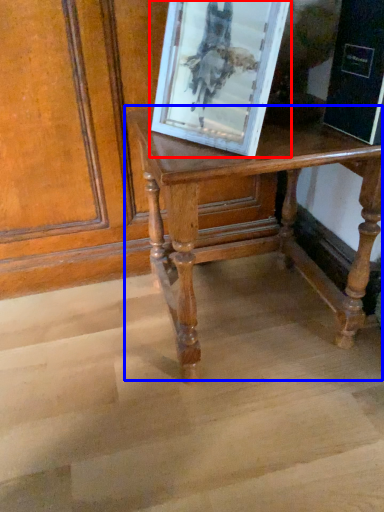
Question: Which of the following is the closest to the observer, picture frame (highlighted by a red box) or table (highlighted by a blue box)?

Choices:
 (A) picture frame
 (B) table

Answer: (A)